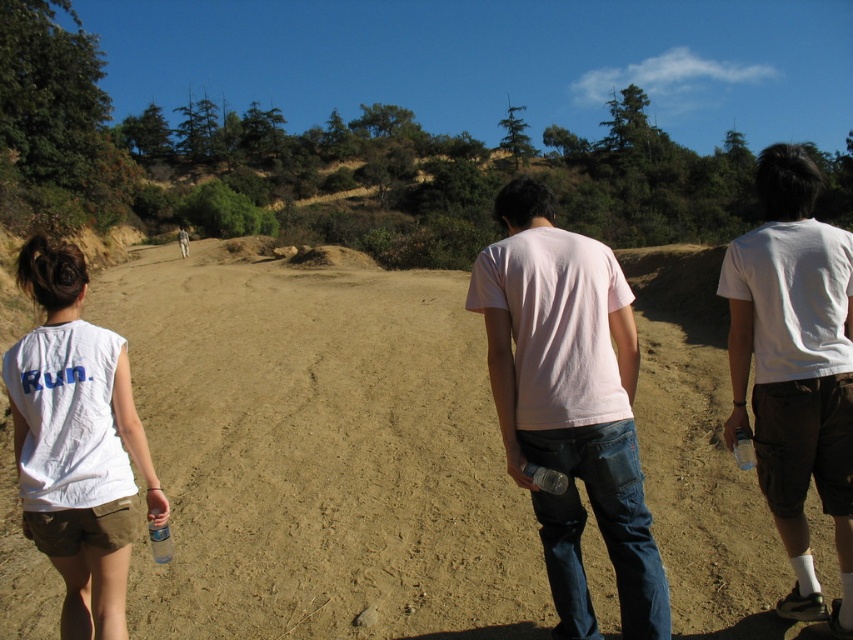
Question: Which object is farther from the camera taking this photo?

Choices:
 (A) white matte t-shirt at center
 (B) white cotton t-shirt at center
 (C) brown sandy ground at center

Answer: (C)

Question: Does brown sandy ground at center appear on the right side of white matte t-shirt at center?

Choices:
 (A) yes
 (B) no

Answer: (B)

Question: From the image, what is the correct spatial relationship of white cotton t-shirt at center in relation to white cotton shirt at left?

Choices:
 (A) above
 (B) below

Answer: (A)

Question: Estimate the real-world distances between objects in this image. Which object is closer to the white cotton shirt at left?

Choices:
 (A) white cotton t-shirt at center
 (B) brown sandy ground at center

Answer: (A)

Question: Among these objects, which one is farthest from the camera?

Choices:
 (A) white matte t-shirt at center
 (B) white cotton shirt at left
 (C) brown sandy ground at center
 (D) white cotton t-shirt at center

Answer: (C)

Question: Does brown sandy ground at center have a smaller size compared to white cotton shirt at left?

Choices:
 (A) yes
 (B) no

Answer: (B)